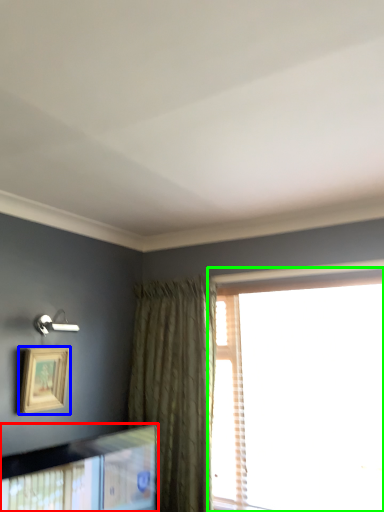
Question: Which is farther away from picture frame (highlighted by a red box)? picture frame (highlighted by a blue box) or window (highlighted by a green box)?

Choices:
 (A) picture frame
 (B) window

Answer: (B)